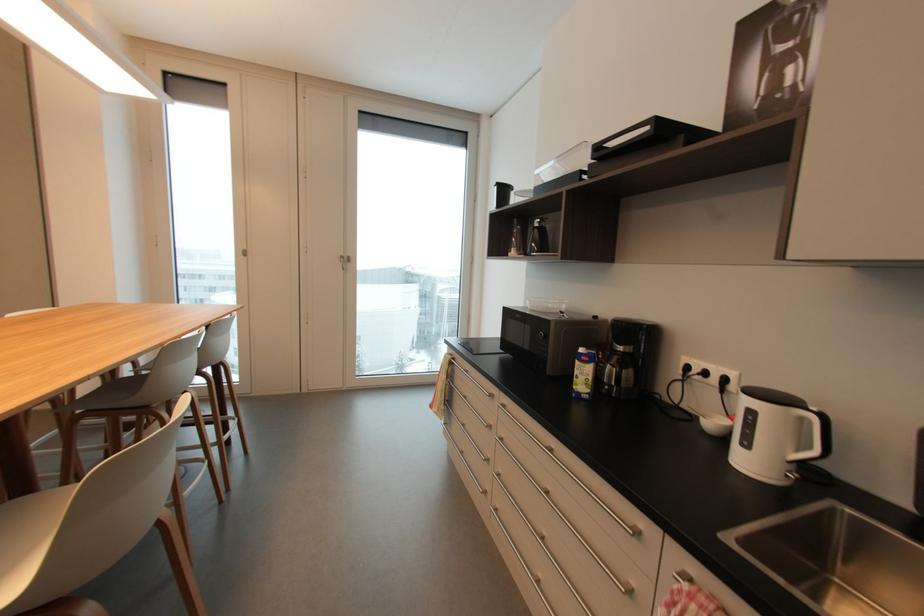
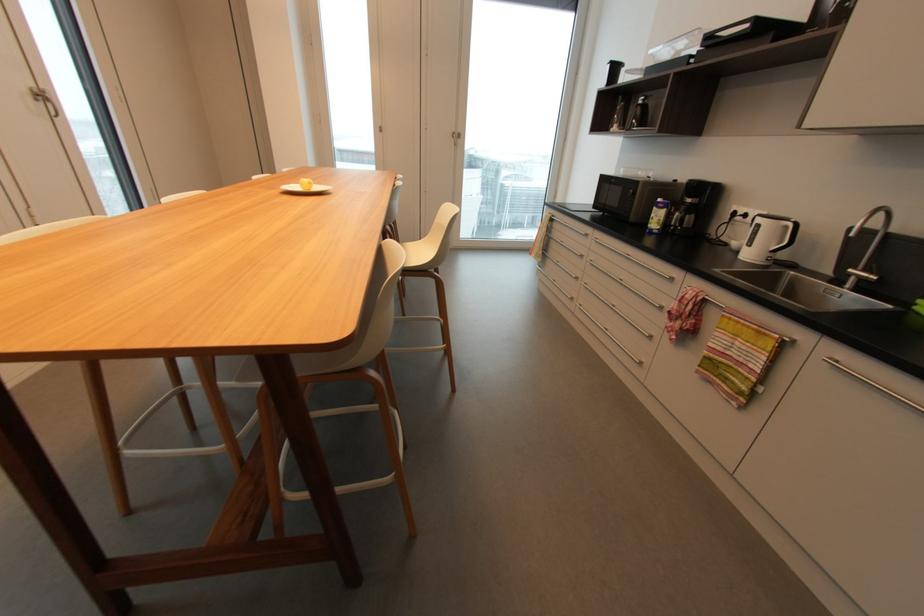
Find the pixel in the second image that matches the point at 585,351 in the first image.

(663, 200)